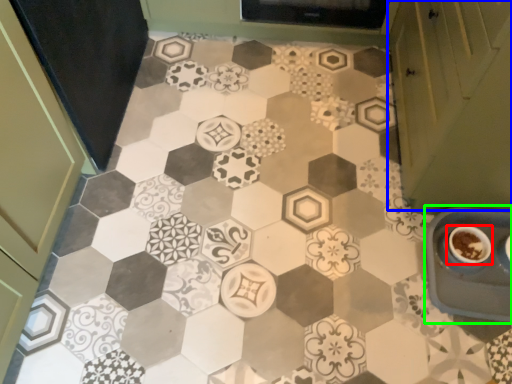
Question: Estimate the real-world distances between objects in this image. Which object is closer to coffee cup (highlighted by a red box), cabinetry (highlighted by a blue box) or sink (highlighted by a green box)?

Choices:
 (A) cabinetry
 (B) sink

Answer: (B)